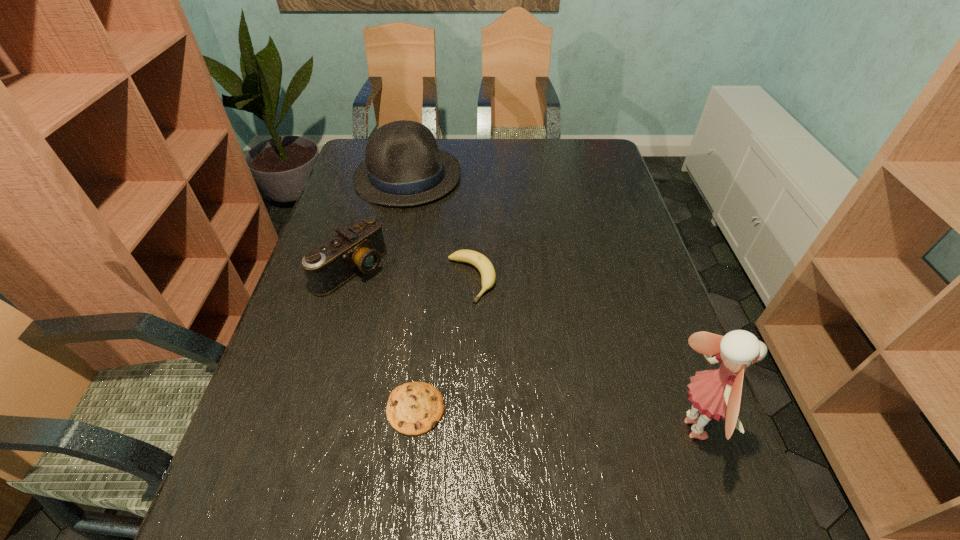
Where is `free region at the near right corner of the desktop`? This screenshot has width=960, height=540. free region at the near right corner of the desktop is located at coordinates (690, 448).

Locate an element on the screen. Image resolution: width=960 pixels, height=540 pixels. blank region between the shortest object and the fourth tallest object is located at coordinates (444, 344).

Locate an element on the screen. The width and height of the screenshot is (960, 540). blank region between the bowler hat and the banana is located at coordinates (440, 228).

Locate an element on the screen. The image size is (960, 540). vacant space that's between the banana and the farthest object is located at coordinates (440, 228).

Where is `free spot between the farthest object and the shortest object`? free spot between the farthest object and the shortest object is located at coordinates (412, 293).

Locate an element on the screen. The width and height of the screenshot is (960, 540). vacant area that lies between the banana and the rightmost object is located at coordinates (579, 354).

Image resolution: width=960 pixels, height=540 pixels. Find the location of `free point between the doll and the farthest object`. free point between the doll and the farthest object is located at coordinates (547, 303).

Locate an element on the screen. This screenshot has height=540, width=960. unoccupied area between the banana and the third shortest object is located at coordinates (411, 274).

Identify the location of vacant area between the second shortest object and the camera. Image resolution: width=960 pixels, height=540 pixels. (411, 274).

This screenshot has height=540, width=960. Identify the location of vacant space that's between the banana and the cookie. (444, 344).